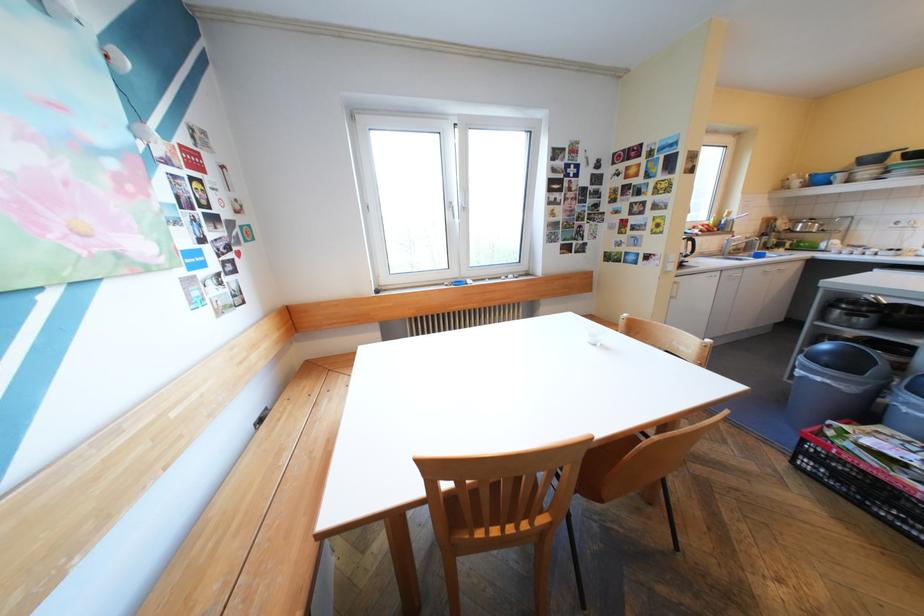
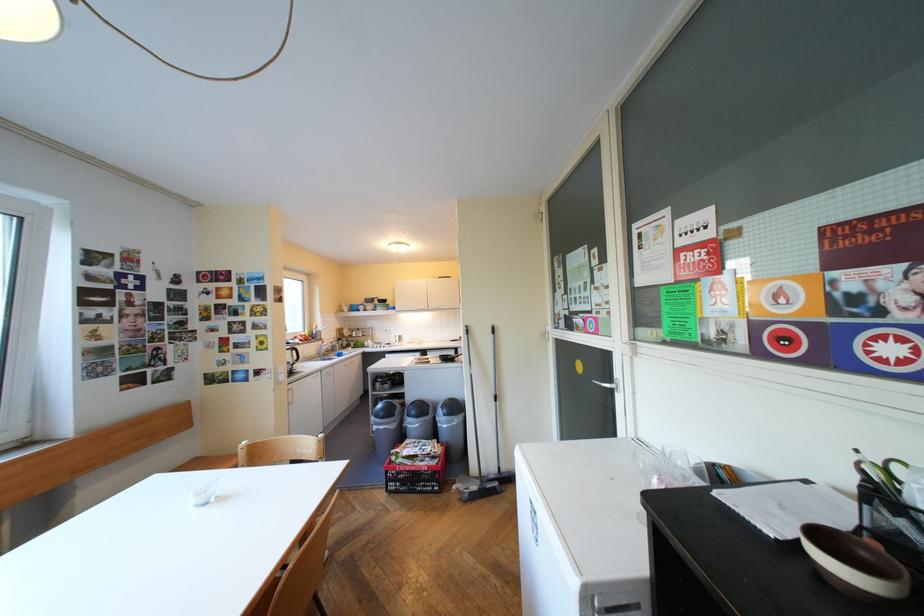
The point at (858,426) is marked in the first image. Where is the corresponding point in the second image?

(410, 448)